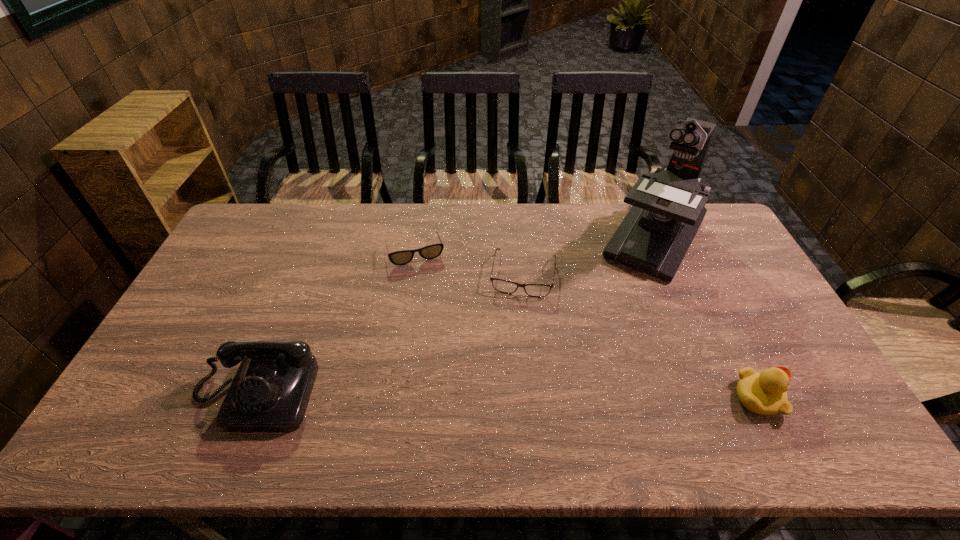
The image size is (960, 540). I want to click on the second closest object to the third shortest object, so click(x=535, y=290).

Find the location of a particular element. Image resolution: width=960 pixels, height=540 pixels. object that stands as the fourth closest to the microscope is located at coordinates (270, 391).

Locate an element on the screen. The height and width of the screenshot is (540, 960). free spot that satisfies the following two spatial constraints: 1. on the back side of the fourth object from right to left; 2. on the left side of the microscope is located at coordinates (417, 239).

You are a GUI agent. You are given a task and a screenshot of the screen. Output one action in this format:
    pyautogui.click(x=<x>, y=<y>)
    Task: Click on the free spot that satisfies the following two spatial constraints: 1. on the front side of the duckling; 2. on the front-facing side of the spectacles
    This screenshot has height=540, width=960.
    Given the screenshot: What is the action you would take?
    pyautogui.click(x=535, y=397)

You are a GUI agent. You are given a task and a screenshot of the screen. Output one action in this format:
    pyautogui.click(x=<x>, y=<y>)
    Task: Click on the vacant region that satisfies the following two spatial constraints: 1. on the dial of the third tallest object; 2. on the front-facing side of the fourth shortest object
    This screenshot has height=540, width=960.
    Given the screenshot: What is the action you would take?
    pyautogui.click(x=254, y=397)